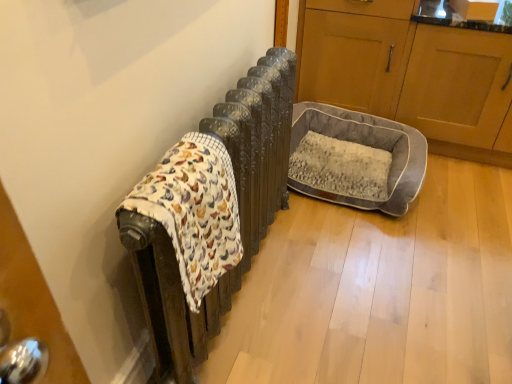
Question: Can you confirm if wooden cabinet at right, acting as the second screen door starting from the back, is shorter than gray plush dog bed at center?

Choices:
 (A) yes
 (B) no

Answer: (B)

Question: Is wooden cabinet at right, acting as the second screen door starting from the back, wider than gray plush dog bed at center?

Choices:
 (A) yes
 (B) no

Answer: (A)

Question: Can you confirm if wooden cabinet at right, which appears as the 1th screen door when viewed from the front, is smaller than gray plush dog bed at center?

Choices:
 (A) no
 (B) yes

Answer: (A)

Question: Does wooden cabinet at right, acting as the second screen door starting from the back, have a larger size compared to gray plush dog bed at center?

Choices:
 (A) yes
 (B) no

Answer: (A)

Question: Could gray plush dog bed at center be considered to be inside wooden cabinet at right, acting as the second screen door starting from the back?

Choices:
 (A) no
 (B) yes

Answer: (A)

Question: Is wooden cabinet at right, which appears as the 1th screen door when viewed from the front, positioned far away from gray plush dog bed at center?

Choices:
 (A) no
 (B) yes

Answer: (A)

Question: Is fluffy cotton blanket at left looking in the opposite direction of gray fabric pet bed at right, which is the 1th screen door in back-to-front order?

Choices:
 (A) yes
 (B) no

Answer: (B)

Question: Is fluffy cotton blanket at left behind gray fabric pet bed at right, which is the 1th screen door in back-to-front order?

Choices:
 (A) no
 (B) yes

Answer: (A)

Question: From the image's perspective, is fluffy cotton blanket at left on gray fabric pet bed at right, acting as the second screen door starting from the front?

Choices:
 (A) yes
 (B) no

Answer: (B)

Question: Is fluffy cotton blanket at left at the left side of gray fabric pet bed at right, which is the 1th screen door in back-to-front order?

Choices:
 (A) no
 (B) yes

Answer: (B)

Question: Does fluffy cotton blanket at left have a lesser height compared to gray fabric pet bed at right, acting as the second screen door starting from the front?

Choices:
 (A) yes
 (B) no

Answer: (A)

Question: From the image's perspective, would you say fluffy cotton blanket at left is shown under gray fabric pet bed at right, acting as the second screen door starting from the front?

Choices:
 (A) yes
 (B) no

Answer: (A)

Question: Is the depth of fluffy cotton blanket at left greater than that of wooden cabinet at right, which appears as the 1th screen door when viewed from the front?

Choices:
 (A) no
 (B) yes

Answer: (A)